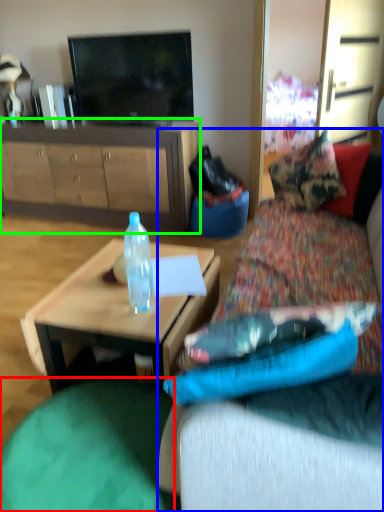
Question: Which is nearer to the bean bag chair (highlighted by a red box)? studio couch (highlighted by a blue box) or cabinetry (highlighted by a green box).

Choices:
 (A) studio couch
 (B) cabinetry

Answer: (A)